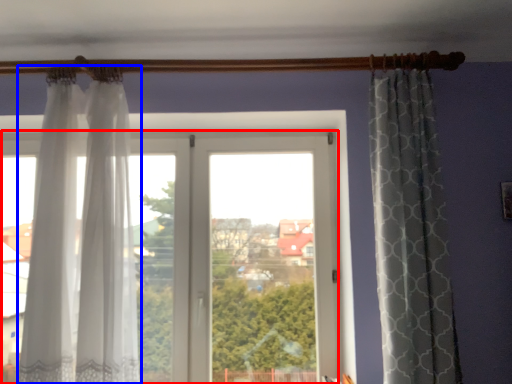
Question: Which point is further to the camera, window (highlighted by a red box) or curtain (highlighted by a blue box)?

Choices:
 (A) window
 (B) curtain

Answer: (A)